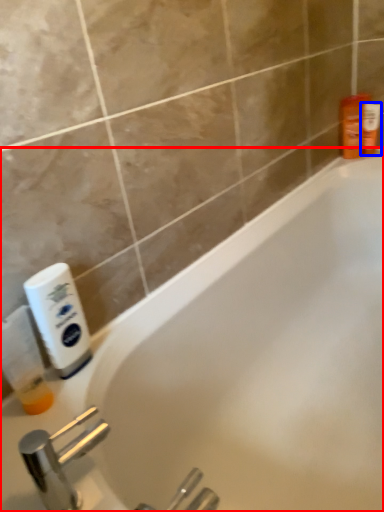
Question: Which object appears farthest to the camera in this image, bathtub (highlighted by a red box) or toiletry (highlighted by a blue box)?

Choices:
 (A) bathtub
 (B) toiletry

Answer: (B)